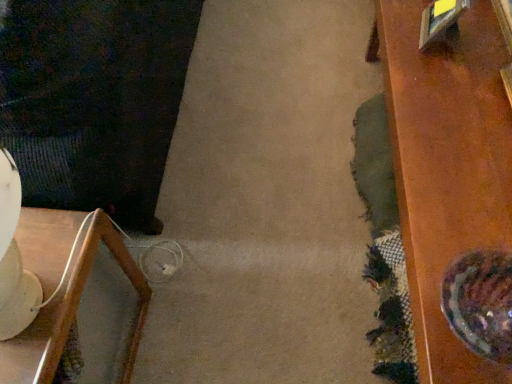
Locate an element on the screen. wooden tray at lower left is located at coordinates (73, 312).

This screenshot has width=512, height=384. What do you see at coordinates (73, 312) in the screenshot?
I see `wooden tray at lower left` at bounding box center [73, 312].

Find the location of a particular element. This screenshot has width=512, height=384. wooden tray at lower left is located at coordinates (73, 312).